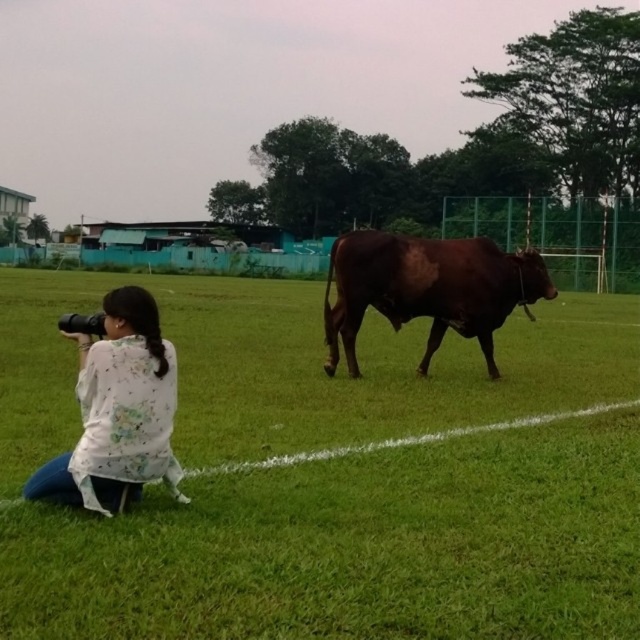
Measure the distance between green grass at lower center and white floral shirt at lower left.

green grass at lower center is 7.61 feet from white floral shirt at lower left.

Where is `green grass at lower center`? The height and width of the screenshot is (640, 640). green grass at lower center is located at coordinates (332, 476).

What are the coordinates of `green grass at lower center` in the screenshot? It's located at (332, 476).

Find the location of a particular element. The width and height of the screenshot is (640, 640). white floral shirt at lower left is located at coordinates (118, 412).

Is point (67, 493) positioned before point (476, 298)?

Yes.

Between point (86, 358) and point (406, 291), which one is positioned in front?

Point (86, 358) is in front.

Where is `white floral shirt at lower left`? The height and width of the screenshot is (640, 640). white floral shirt at lower left is located at coordinates (118, 412).

The image size is (640, 640). What do you see at coordinates (332, 476) in the screenshot? I see `green grass at lower center` at bounding box center [332, 476].

Between point (371, 390) and point (540, 285), which one is positioned behind?

Positioned behind is point (540, 285).

Locate an element on the screen. green grass at lower center is located at coordinates [332, 476].